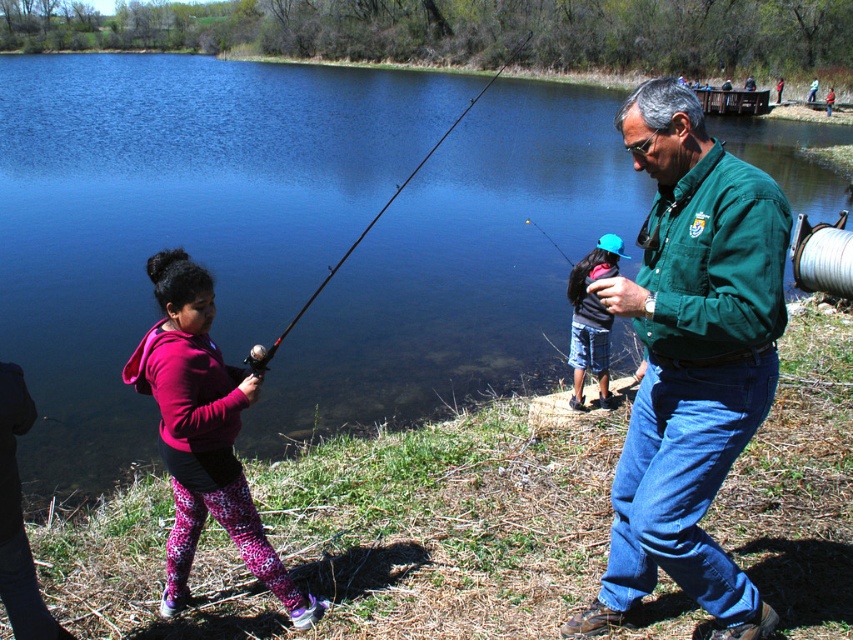
Question: Observing the image, what is the correct spatial positioning of blue water at center in reference to blue denim shorts at lower center?

Choices:
 (A) left
 (B) right

Answer: (A)

Question: Can you confirm if matte pink hoodie at center is smaller than black matte fishing pole at center?

Choices:
 (A) yes
 (B) no

Answer: (A)

Question: Which point appears farthest from the camera in this image?

Choices:
 (A) (223, 145)
 (B) (160, 381)
 (C) (641, 531)

Answer: (A)

Question: Which point appears closest to the camera in this image?

Choices:
 (A) (448, 129)
 (B) (576, 273)

Answer: (B)

Question: Based on their relative distances, which object is farther from the matte pink hoodie at center?

Choices:
 (A) blue denim shorts at lower center
 (B) black matte fishing pole at center

Answer: (B)

Question: Does matte pink hoodie at center appear on the left side of blue denim shorts at lower center?

Choices:
 (A) no
 (B) yes

Answer: (B)